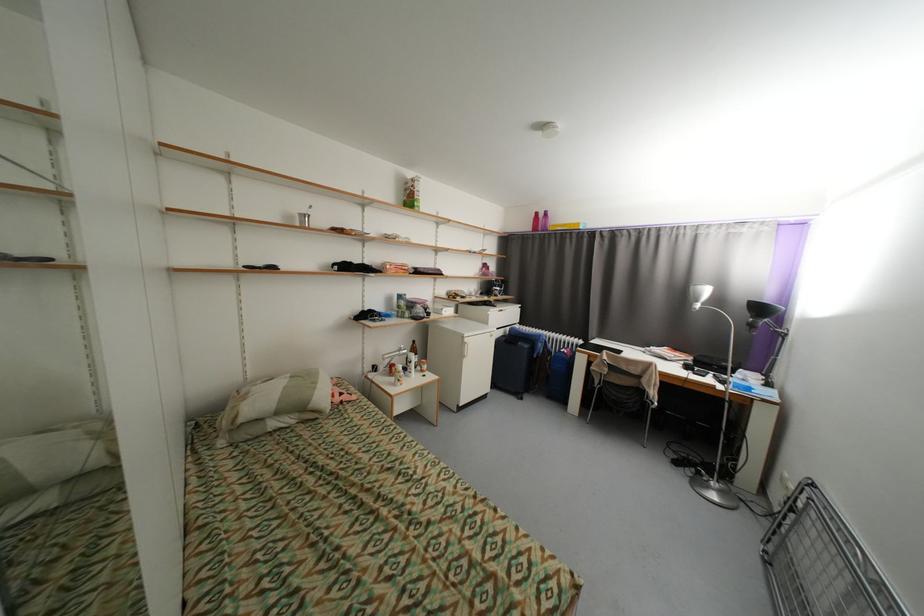
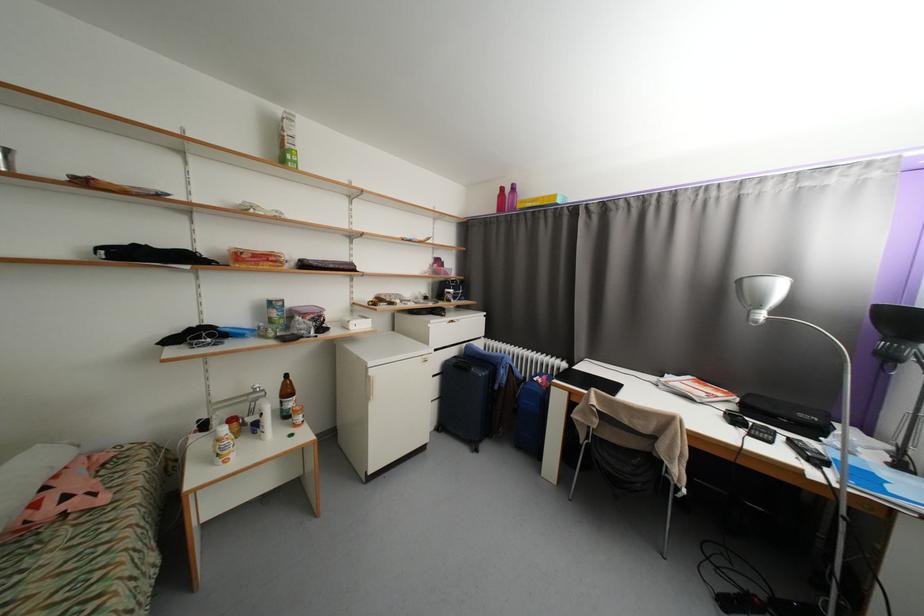
Find the pixel in the second image that matches (718,376) in the first image.

(787, 439)